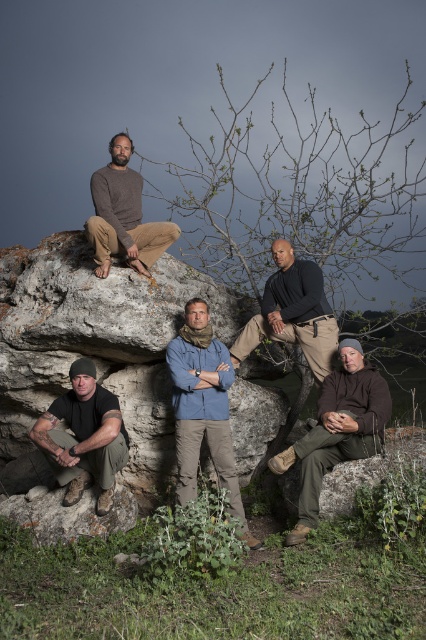
You are standing at the point with coordinates point (233, 346) and want to move towards the leafless tree in the background. Is the point (69, 422) between you and the tree?

Point (69, 422) is in front of point (233, 346), so yes, the point (69, 422) is between you and the tree.

You are standing in a rocky area with two points marked in the image. The first point is at coordinate point (109, 435) and the second is at coordinate point (137, 259). If you want to reach the point closer to you first, which coordinate should you head towards?

You should head towards point (109, 435) because it is closer to the viewer than point (137, 259).